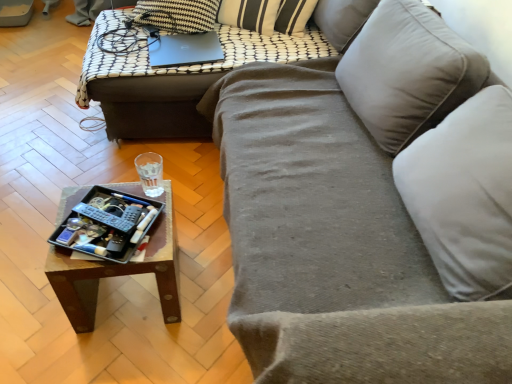
I want to click on empty space that is ontop of wooden tray at center (from a real-world perspective), so click(x=95, y=232).